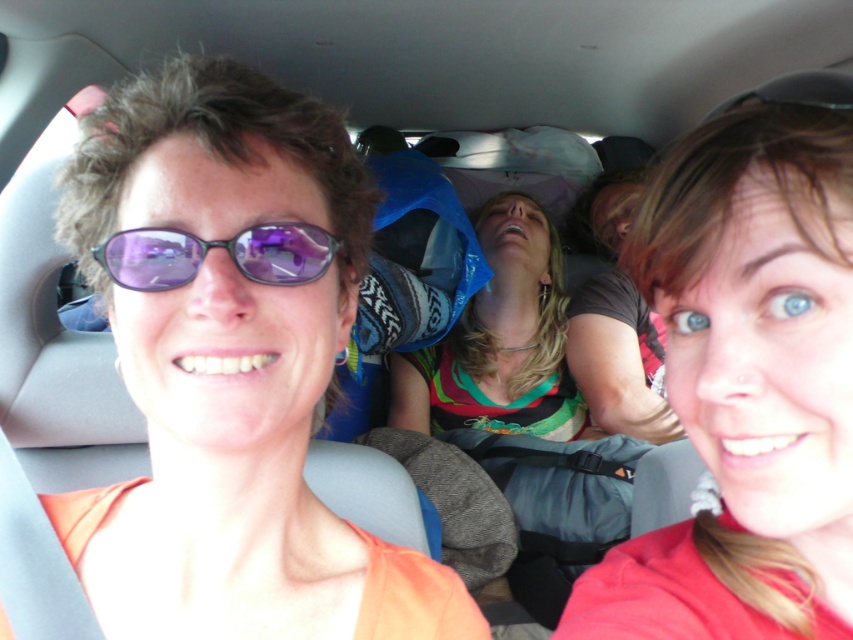
Question: Estimate the real-world distances between objects in this image. Which object is farther from the smooth red shirt at center?

Choices:
 (A) purple reflective sunglasses at center
 (B) multicolored jersey at center

Answer: (B)

Question: Does smooth red shirt at center appear on the right side of purple reflective sunglasses at center?

Choices:
 (A) no
 (B) yes

Answer: (B)

Question: Can you confirm if smooth red shirt at center is wider than purple reflective sunglasses at center?

Choices:
 (A) no
 (B) yes

Answer: (B)

Question: Among these points, which one is farthest from the camera?

Choices:
 (A) (807, 321)
 (B) (144, 243)

Answer: (B)

Question: Which object is the closest to the multicolored jersey at center?

Choices:
 (A) purple reflective sunglasses at center
 (B) smooth red shirt at center

Answer: (B)

Question: Observing the image, what is the correct spatial positioning of multicolored jersey at center in reference to purple reflective sunglasses at center?

Choices:
 (A) right
 (B) left

Answer: (A)